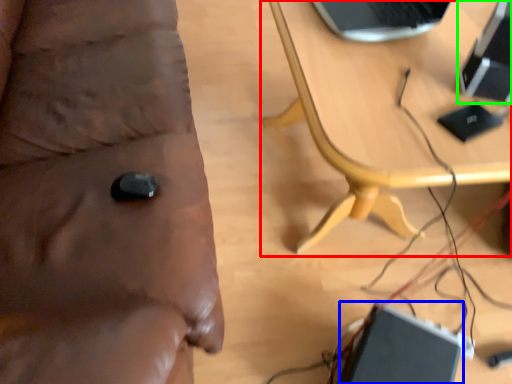
Question: Based on their relative distances, which object is nearer to table (highlighted by a red box)? Choose from laptop (highlighted by a blue box) and computer (highlighted by a green box).

Choices:
 (A) laptop
 (B) computer

Answer: (B)